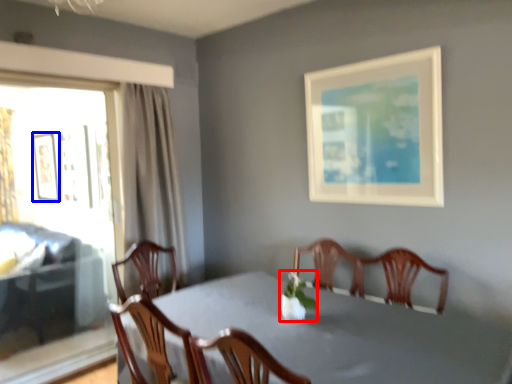
Question: Among these objects, which one is farthest to the camera, floral arrangement (highlighted by a red box) or picture frame (highlighted by a blue box)?

Choices:
 (A) floral arrangement
 (B) picture frame

Answer: (B)